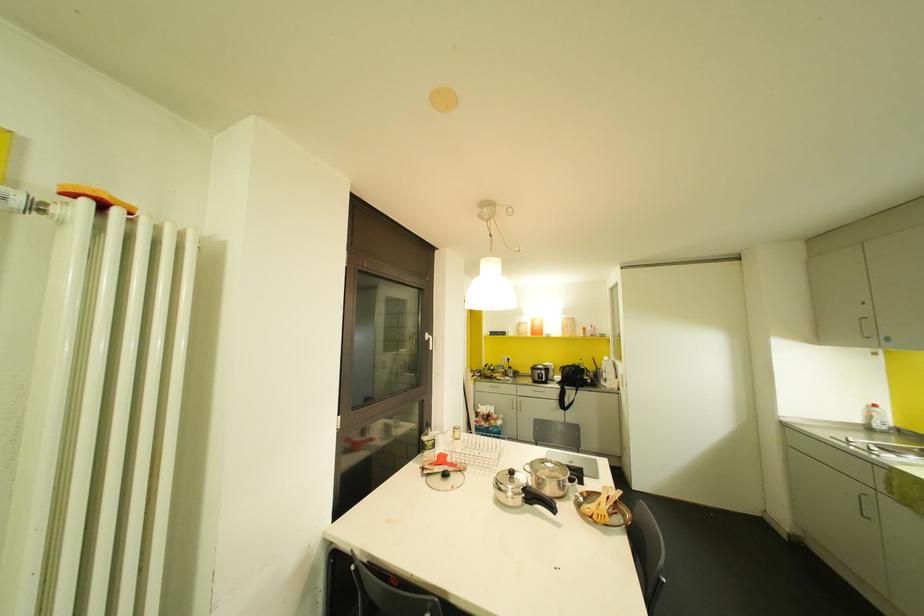
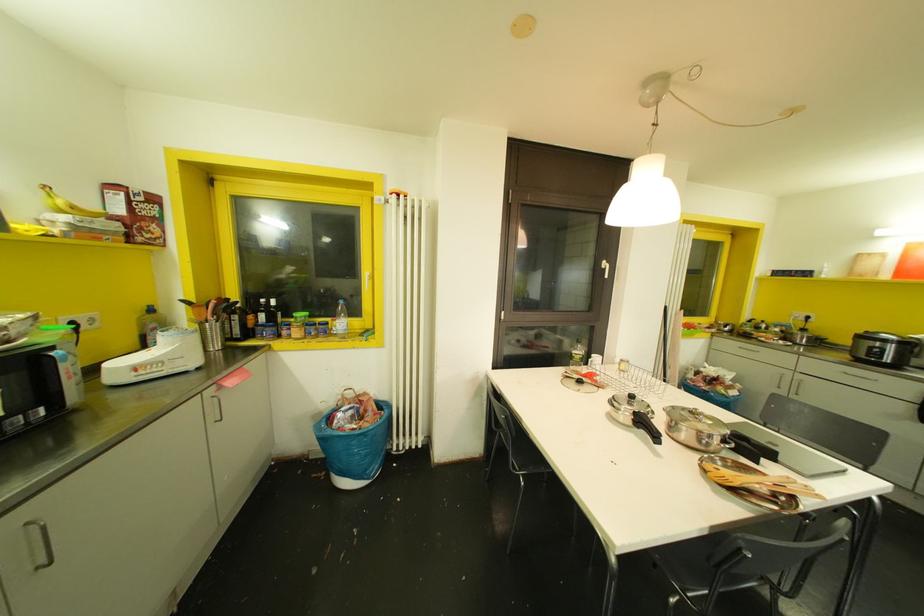
Question: The first image is from the beginning of the video and the second image is from the end. How did the camera likely rotate when shooting the video?

Choices:
 (A) Left
 (B) Right
 (C) Up
 (D) Down

Answer: (A)